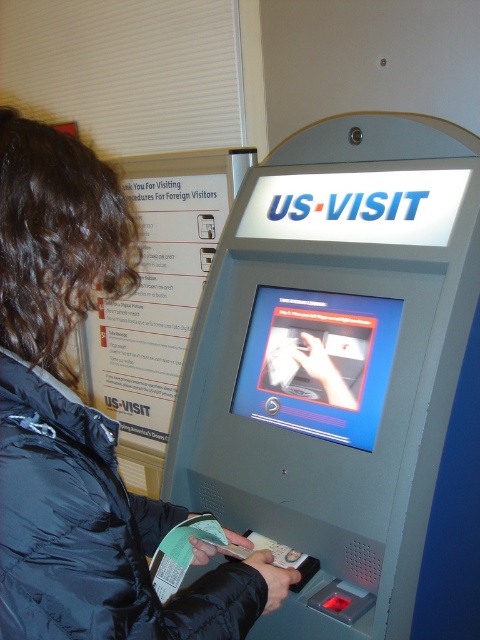
You are an airport security officer observing a traveler wearing two jackets at the US Visit kiosk. The traveler has a black matte jacket at center and a black puffy jacket at center. Which jacket is bigger in size?

The black matte jacket at center is larger in size than the black puffy jacket at center.

Looking at this image, you are a traveler at an airport and need to use the gray metallic kiosk at center. The black matte jacket at center is blocking your path. Can you step around the kiosk without moving the jacket?

The distance between the gray metallic kiosk at center and the black matte jacket at center is 15.73 inches. Since this space is narrow, you might have difficulty stepping around the kiosk without moving the jacket.

You are a traveler at an airport and need to use the US Visit kiosk. You see the gray metallic kiosk at center and the black matte jacket at center. Which object is closer to you?

The gray metallic kiosk at center is positioned over the black matte jacket at center, indicating it is closer to you.